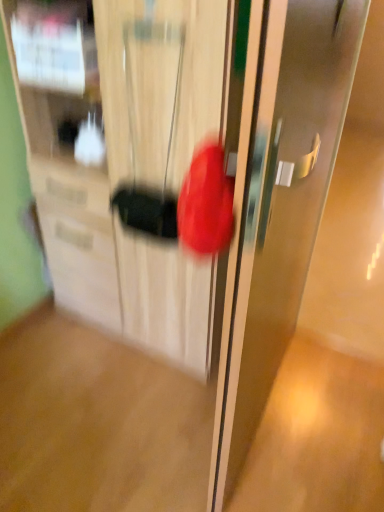
The image size is (384, 512). Describe the element at coordinates (130, 159) in the screenshot. I see `matte wooden cabinet at center` at that location.

Measure the distance between matte wooden cabinet at center and camera.

36.94 inches.

This screenshot has height=512, width=384. Identify the location of matte wooden cabinet at center. (130, 159).

What is the approximate width of satin silver door at center?

satin silver door at center is 7.91 centimeters in width.

The height and width of the screenshot is (512, 384). What do you see at coordinates (278, 202) in the screenshot?
I see `satin silver door at center` at bounding box center [278, 202].

Where is `satin silver door at center`? satin silver door at center is located at coordinates (278, 202).

You are a GUI agent. You are given a task and a screenshot of the screen. Output one action in this format:
    pyautogui.click(x=<x>, y=<y>)
    Task: Click on the matte wooden cabinet at center
    The width and height of the screenshot is (384, 512).
    Given the screenshot: What is the action you would take?
    pyautogui.click(x=130, y=159)

Considering the relative positions of matte wooden cabinet at center and satin silver door at center in the image provided, is matte wooden cabinet at center to the left of satin silver door at center from the viewer's perspective?

Yes, matte wooden cabinet at center is to the left of satin silver door at center.

Is matte wooden cabinet at center in front of or behind satin silver door at center in the image?

In the image, matte wooden cabinet at center appears behind satin silver door at center.

Which is nearer, (83, 95) or (220, 369)?

The point (220, 369) is closer to the camera.

From the image's perspective, which one is positioned lower, matte wooden cabinet at center or satin silver door at center?

satin silver door at center is shown below in the image.

From a real-world perspective, is matte wooden cabinet at center below satin silver door at center?

Yes.

In terms of width, does matte wooden cabinet at center look wider or thinner when compared to satin silver door at center?

In the image, matte wooden cabinet at center appears to be wider than satin silver door at center.

Considering the relative sizes of matte wooden cabinet at center and satin silver door at center in the image provided, is matte wooden cabinet at center shorter than satin silver door at center?

Indeed, matte wooden cabinet at center has a lesser height compared to satin silver door at center.

Between matte wooden cabinet at center and satin silver door at center, which one has larger size?

Bigger between the two is matte wooden cabinet at center.

Choose the correct answer: Is matte wooden cabinet at center inside satin silver door at center or outside it?

matte wooden cabinet at center is not enclosed by satin silver door at center.

Is matte wooden cabinet at center not close to satin silver door at center?

No, there isn't a large distance between matte wooden cabinet at center and satin silver door at center.

Is matte wooden cabinet at center oriented away from satin silver door at center?

No, matte wooden cabinet at center is not facing away from satin silver door at center.

Based on the photo, can you tell me how much matte wooden cabinet at center and satin silver door at center differ in facing direction?

96.5 degrees separate the facing orientations of matte wooden cabinet at center and satin silver door at center.

You are a GUI agent. You are given a task and a screenshot of the screen. Output one action in this format:
    pyautogui.click(x=<x>, y=<y>)
    Task: Click on the cabinetry behind the satin silver door at center
    This screenshot has width=384, height=512.
    Given the screenshot: What is the action you would take?
    pyautogui.click(x=130, y=159)

Visually, is satin silver door at center positioned to the left or to the right of matte wooden cabinet at center?

Clearly, satin silver door at center is on the right of matte wooden cabinet at center in the image.

Considering the positions of objects satin silver door at center and matte wooden cabinet at center in the image provided, who is behind, satin silver door at center or matte wooden cabinet at center?

matte wooden cabinet at center is further away from the camera.

Which point is more distant from viewer, (334, 156) or (180, 297)?

Point (334, 156)

From the image's perspective, is satin silver door at center located above or below matte wooden cabinet at center?

satin silver door at center is situated lower than matte wooden cabinet at center in the image.

From a real-world perspective, is satin silver door at center above or below matte wooden cabinet at center?

From a real-world perspective, satin silver door at center is physically above matte wooden cabinet at center.

Which object is thinner, satin silver door at center or matte wooden cabinet at center?

With smaller width is satin silver door at center.

Considering the relative sizes of satin silver door at center and matte wooden cabinet at center in the image provided, is satin silver door at center shorter than matte wooden cabinet at center?

No, satin silver door at center is not shorter than matte wooden cabinet at center.

Can you confirm if satin silver door at center is smaller than matte wooden cabinet at center?

Yes, satin silver door at center is smaller than matte wooden cabinet at center.

Is satin silver door at center inside the boundaries of matte wooden cabinet at center, or outside?

The correct answer is: outside.

Is satin silver door at center far away from matte wooden cabinet at center?

Actually, satin silver door at center and matte wooden cabinet at center are a little close together.

Is satin silver door at center turned away from matte wooden cabinet at center?

Yes, satin silver door at center's orientation is away from matte wooden cabinet at center.

What's the angular difference between satin silver door at center and matte wooden cabinet at center's facing directions?

96.5 degrees separate the facing orientations of satin silver door at center and matte wooden cabinet at center.

Measure the distance between satin silver door at center and matte wooden cabinet at center.

satin silver door at center and matte wooden cabinet at center are 20.18 inches apart.

There is a matte wooden cabinet at center. Where is `door above it (from a real-world perspective)`? The image size is (384, 512). door above it (from a real-world perspective) is located at coordinates (278, 202).

What are the coordinates of `cabinetry above the satin silver door at center (from the image's perspective)` in the screenshot? It's located at (130, 159).

The height and width of the screenshot is (512, 384). I want to click on cabinetry on the left of satin silver door at center, so click(130, 159).